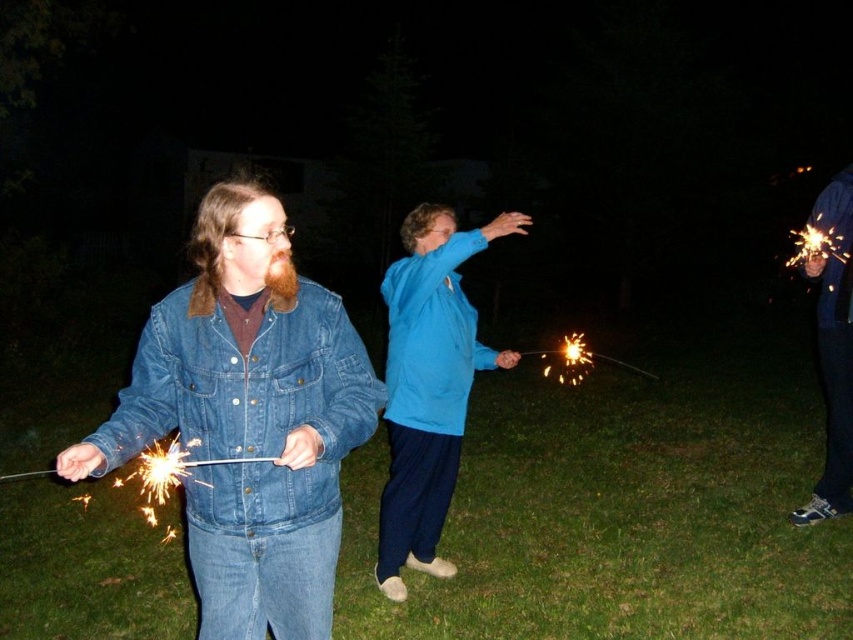
Who is more distant from viewer, (402, 593) or (849, 212)?

The point (849, 212) is behind.

At what (x,y) coordinates should I click in order to perform the action: click on blue fabric jacket at center. Please return your answer as a coordinate pair (x, y). Looking at the image, I should click on (428, 385).

Is denim jacket at left thinner than blue fabric jacket at center?

Indeed, denim jacket at left has a lesser width compared to blue fabric jacket at center.

Who is more distant from viewer, [241,250] or [401,420]?

Point [401,420]

Image resolution: width=853 pixels, height=640 pixels. I want to click on denim jacket at left, so click(248, 419).

Can you confirm if denim jacket at left is positioned above denim jacket at right?

No, denim jacket at left is not above denim jacket at right.

How much distance is there between denim jacket at left and denim jacket at right?

They are 3.48 meters apart.

Locate an element on the screen. denim jacket at left is located at coordinates (248, 419).